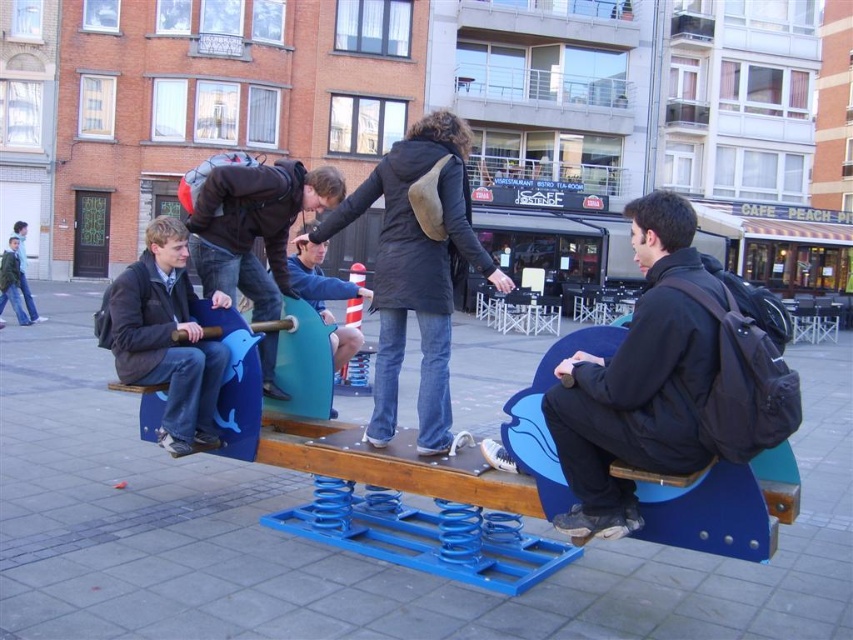
Based on the photo, you are a parent trying to determine which child is closer to the center of the seesaw to ensure balance. You see two boys wearing jackets labeled as black matte jacket at center and matte black jacket at center. Which jacket is wider, potentially affecting their position?

The black matte jacket at center is wider than the matte black jacket at center, so the child wearing it may be positioned further out to balance the seesaw.

Looking at this image, you are standing at the camera position and want to pick up an object located at point (581, 397). If your arm can reach up to 3 meters, will you be able to reach it?

The distance of point (581, 397) from camera is 3.78 meters, so no, you cannot reach it since it is farther than your arm can extend.